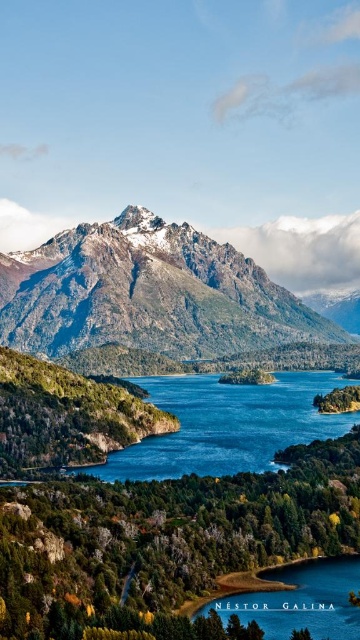
Question: Which object is the closest to the blue glassy water at lower center?

Choices:
 (A) blue liquid water at center
 (B) rocky gray mountain at center

Answer: (A)

Question: Is rocky gray mountain at center to the right of blue liquid water at center from the viewer's perspective?

Choices:
 (A) yes
 (B) no

Answer: (B)

Question: Is rocky gray mountain at center behind blue glassy water at lower center?

Choices:
 (A) yes
 (B) no

Answer: (A)

Question: In this image, where is rocky gray mountain at center located relative to blue glassy water at lower center?

Choices:
 (A) right
 (B) left

Answer: (B)

Question: Which of the following is the closest to the observer?

Choices:
 (A) (145, 273)
 (B) (303, 381)
 (C) (294, 595)

Answer: (C)

Question: Which object is the closest to the blue liquid water at center?

Choices:
 (A) blue glassy water at lower center
 (B) rocky gray mountain at center

Answer: (B)